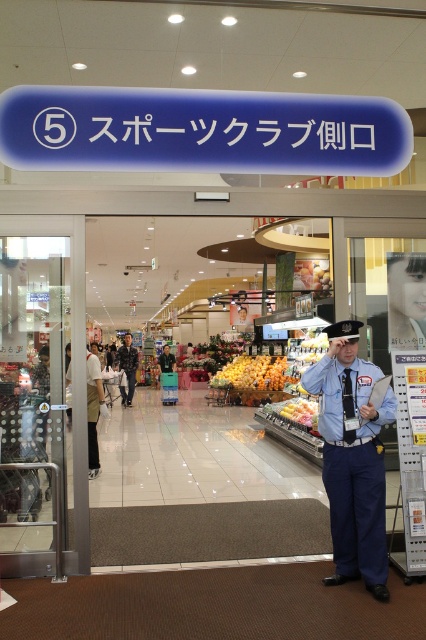
Question: Is glossy orange fruits at center thinner than camouflage fabric uniform at center?

Choices:
 (A) no
 (B) yes

Answer: (A)

Question: Which object is closer to the camera taking this photo?

Choices:
 (A) glossy orange fruits at center
 (B) blue uniform at left
 (C) blue uniform at center
 (D) camouflage fabric uniform at center

Answer: (C)

Question: Estimate the real-world distances between objects in this image. Which object is farther from the glossy orange fruits at center?

Choices:
 (A) camouflage fabric uniform at center
 (B) blue uniform at center
 (C) blue uniform at left
 (D) yellow matte apples at center

Answer: (B)

Question: Can you confirm if blue uniform at center is positioned to the left of yellow matte apples at center?

Choices:
 (A) no
 (B) yes

Answer: (B)

Question: Which of the following is the farthest from the observer?

Choices:
 (A) [x=230, y=381]
 (B) [x=322, y=406]
 (C) [x=131, y=353]

Answer: (C)

Question: Is camouflage fabric uniform at center bigger than yellow matte apples at center?

Choices:
 (A) no
 (B) yes

Answer: (B)